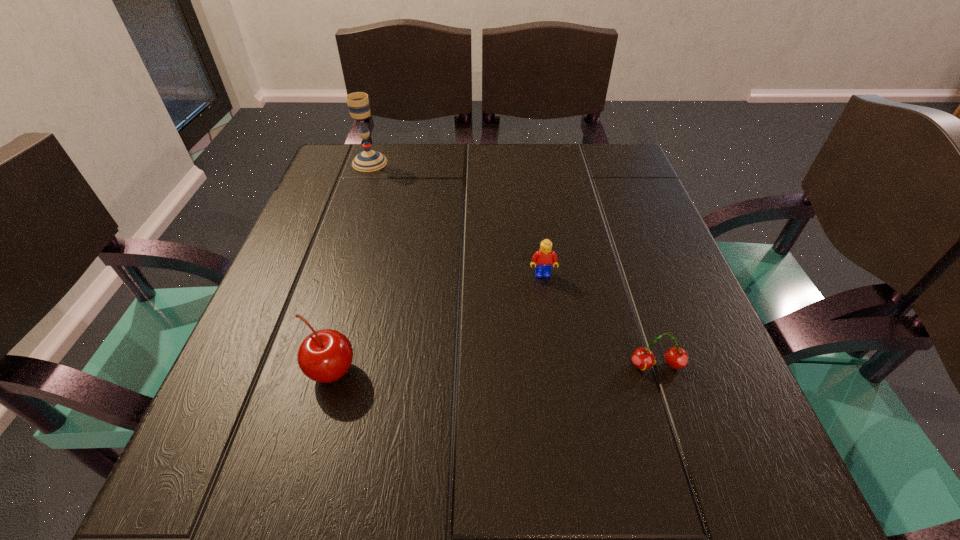
Find the location of a particular element. vacant area that lies between the rightmost object and the second farthest object is located at coordinates (600, 320).

Locate an element on the screen. This screenshot has width=960, height=540. vacant space in between the right cherry and the tallest object is located at coordinates (514, 264).

At what (x,y) coordinates should I click in order to perform the action: click on vacant point located between the rightmost object and the taller cherry. Please return your answer as a coordinate pair (x, y). The height and width of the screenshot is (540, 960). Looking at the image, I should click on (494, 369).

Locate an element on the screen. The width and height of the screenshot is (960, 540). unoccupied position between the tallest object and the shorter cherry is located at coordinates (514, 264).

The height and width of the screenshot is (540, 960). What are the coordinates of `object that is the second closest one to the left cherry` in the screenshot? It's located at (643, 358).

You are a GUI agent. You are given a task and a screenshot of the screen. Output one action in this format:
    pyautogui.click(x=<x>, y=<y>)
    Task: Click on the object that stands as the closest to the third object from left to right
    This screenshot has width=960, height=540.
    Given the screenshot: What is the action you would take?
    pyautogui.click(x=643, y=358)

Where is `free point that satisfies the following two spatial constraints: 1. on the front side of the second tallest object; 2. on the left side of the farthest object`? This screenshot has height=540, width=960. free point that satisfies the following two spatial constraints: 1. on the front side of the second tallest object; 2. on the left side of the farthest object is located at coordinates (300, 372).

Identify the location of vacant area that satisfies the following two spatial constraints: 1. on the front side of the tallest object; 2. on the right side of the left cherry. The image size is (960, 540). (300, 372).